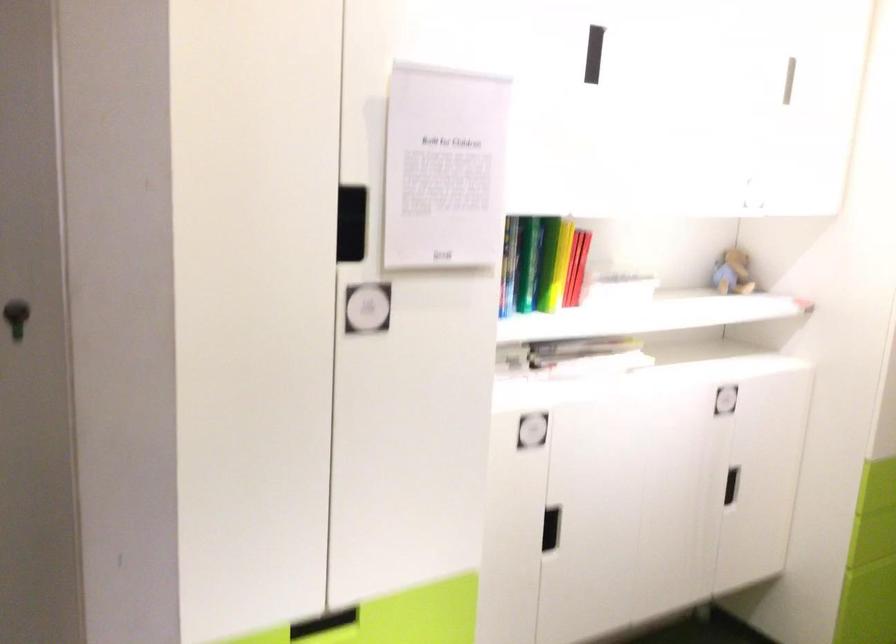
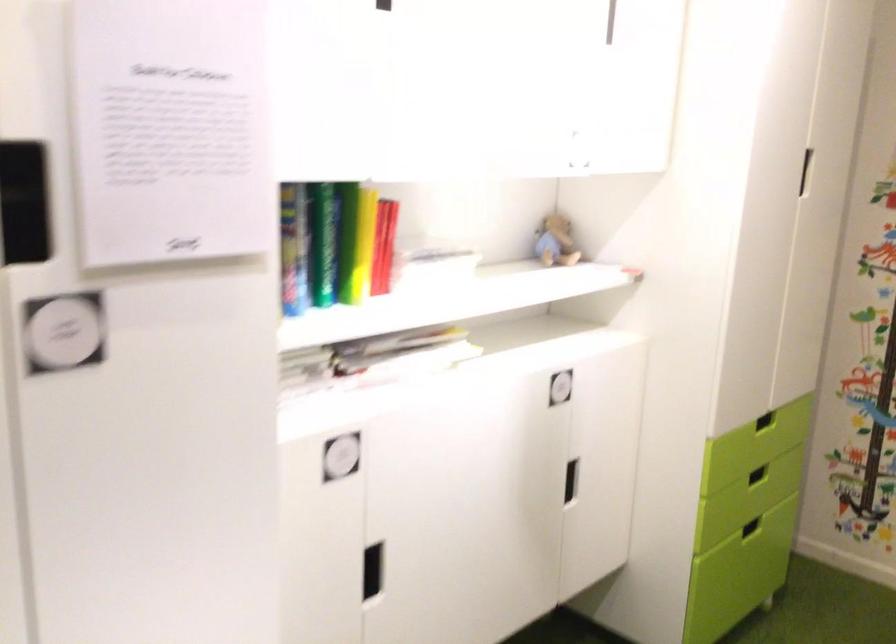
Question: The images are taken continuously from a first-person perspective. In which direction is your viewpoint rotating?

Choices:
 (A) Left
 (B) Right
 (C) Up
 (D) Down

Answer: (B)